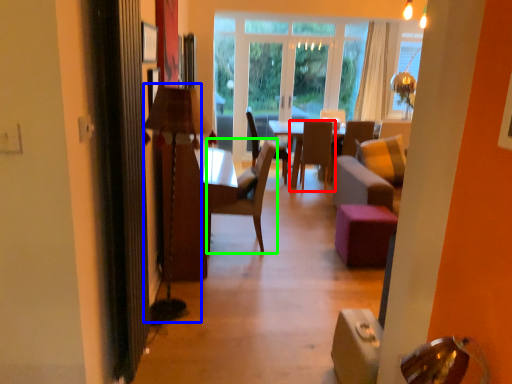
Question: Which is nearer to the chair (highlighted by a red box)? lamp (highlighted by a blue box) or chair (highlighted by a green box).

Choices:
 (A) lamp
 (B) chair

Answer: (B)